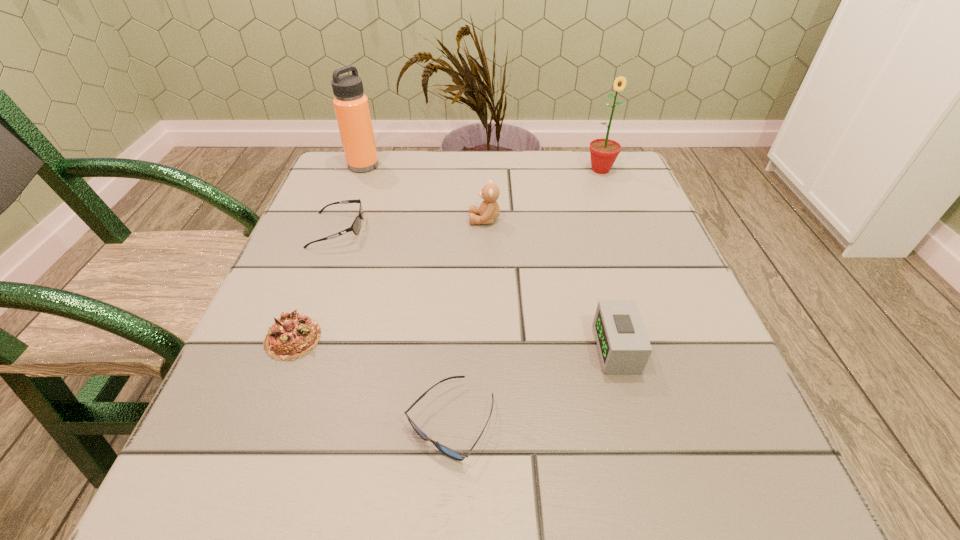
Where is `free space at the far edge of the desktop`? This screenshot has width=960, height=540. free space at the far edge of the desktop is located at coordinates (423, 153).

In the image, there is a desktop. At what (x,y) coordinates should I click in order to perform the action: click on vacant space at the left edge. Please return your answer as a coordinate pair (x, y). The width and height of the screenshot is (960, 540). Looking at the image, I should click on (355, 273).

Find the location of a particular element. This screenshot has width=960, height=540. vacant space at the right edge of the desktop is located at coordinates (656, 286).

At what (x,y) coordinates should I click in order to perform the action: click on vacant space at the far left corner of the desktop. Please return your answer as a coordinate pair (x, y). This screenshot has height=540, width=960. Looking at the image, I should click on (378, 200).

The width and height of the screenshot is (960, 540). Find the location of `free spot at the far right corner of the desktop`. free spot at the far right corner of the desktop is located at coordinates (635, 188).

I want to click on free region at the near right corner, so click(x=698, y=475).

The image size is (960, 540). In order to click on vacant space that is in between the chocolate cake and the nearer sunglasses in this screenshot , I will do `click(372, 380)`.

Identify the location of vacant area that lies between the thermos bottle and the chocolate cake. (328, 252).

Find the location of a particular element. The height and width of the screenshot is (540, 960). empty location between the chocolate cake and the left sunglasses is located at coordinates (315, 284).

The image size is (960, 540). Identify the location of unoccupied area between the third tallest object and the sunflower. (542, 194).